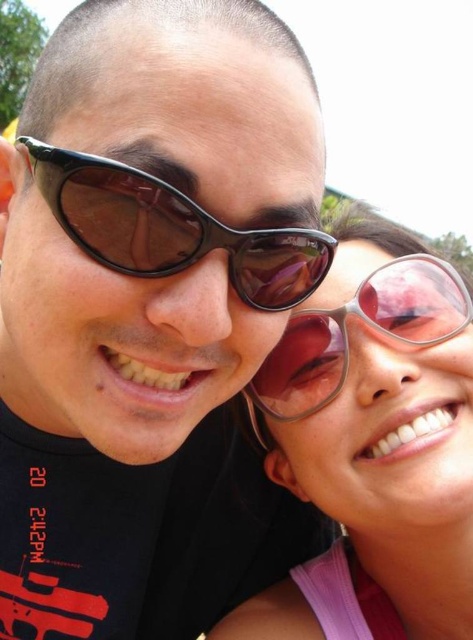
Which is in front, point (8, 493) or point (412, 344)?

Point (412, 344)

Between point (218, 605) and point (289, 355), which one is positioned behind?

The point (218, 605) is behind.

This screenshot has height=640, width=473. Identify the location of matte black sunglasses at center. (151, 316).

Is point (212, 115) positioned behind point (392, 620)?

No.

Can you confirm if matte black sunglasses at center is bigger than pink reflective sunglasses at right?

Indeed, matte black sunglasses at center has a larger size compared to pink reflective sunglasses at right.

Which is behind, point (97, 516) or point (396, 496)?

Positioned behind is point (97, 516).

The height and width of the screenshot is (640, 473). I want to click on matte black sunglasses at center, so pyautogui.click(x=151, y=316).

Is matte black sunglasses at center to the left of black plastic sunglasses at center from the viewer's perspective?

Indeed, matte black sunglasses at center is positioned on the left side of black plastic sunglasses at center.

Between matte black sunglasses at center and black plastic sunglasses at center, which one has less height?

Standing shorter between the two is black plastic sunglasses at center.

Which is in front, point (231, 10) or point (201, 252)?

Point (201, 252)

Locate an element on the screen. matte black sunglasses at center is located at coordinates (151, 316).